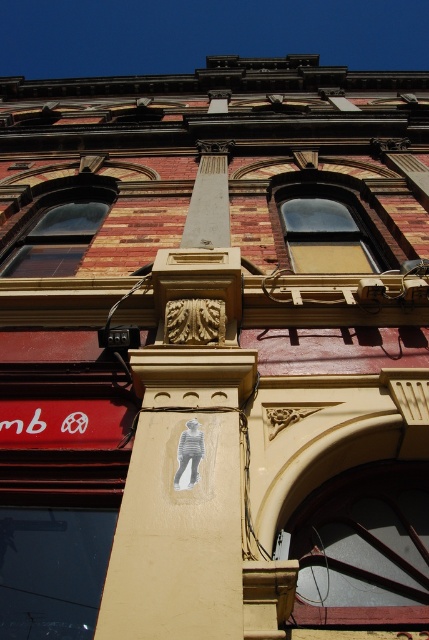
Can you confirm if transparent glass window at center is positioned above transparent glass window at lower left?

Yes.

This screenshot has height=640, width=429. What are the coordinates of `transparent glass window at center` in the screenshot? It's located at (363, 548).

Image resolution: width=429 pixels, height=640 pixels. I want to click on transparent glass window at center, so click(x=363, y=548).

Does clear glass window at upper left have a greater height compared to smooth concrete column at center?

Indeed, clear glass window at upper left has a greater height compared to smooth concrete column at center.

Who is positioned more to the left, clear glass window at upper left or smooth concrete column at center?

Positioned to the left is clear glass window at upper left.

Does point (59, 253) come farther from viewer compared to point (210, 216)?

Yes, it is.

Identify the location of clear glass window at upper left. The width and height of the screenshot is (429, 640). (56, 230).

Is transparent glass window at lower left shorter than clear glass window at upper left?

Yes, transparent glass window at lower left is shorter than clear glass window at upper left.

Is point (51, 540) positioned after point (76, 259)?

No, (51, 540) is closer to viewer.

Which is in front, point (2, 602) or point (32, 241)?

Point (2, 602) is more forward.

Where is `transparent glass window at lower left`? transparent glass window at lower left is located at coordinates (51, 570).